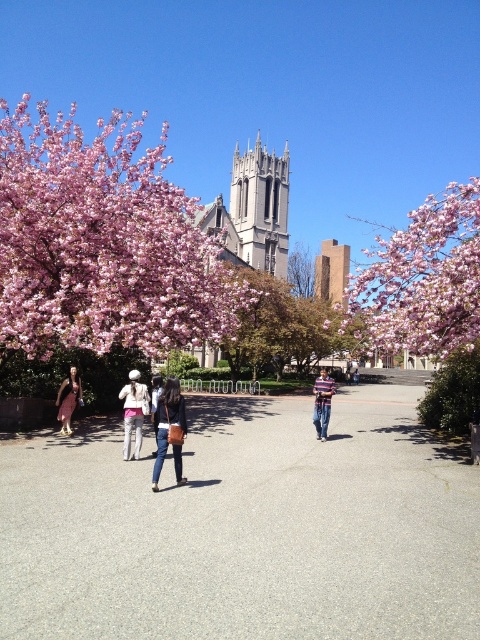
Question: Is gray stone tower at center above white cotton hat at center?

Choices:
 (A) no
 (B) yes

Answer: (B)

Question: Which point appears farthest from the camera in this image?

Choices:
 (A) (276, 250)
 (B) (141, 433)

Answer: (A)

Question: Among these points, which one is nearest to the camera?

Choices:
 (A) (33, 180)
 (B) (320, 380)
 (C) (156, 384)
 (D) (131, 394)

Answer: (A)

Question: Does gray stone tower at center appear on the left side of denim jacket at center?

Choices:
 (A) no
 (B) yes

Answer: (A)

Question: Does pink blossoms at upper left lie behind matte brown dress at lower left?

Choices:
 (A) no
 (B) yes

Answer: (A)

Question: Which object is closer to the camera taking this photo?

Choices:
 (A) gray stone tower at center
 (B) striped shirt at center

Answer: (B)